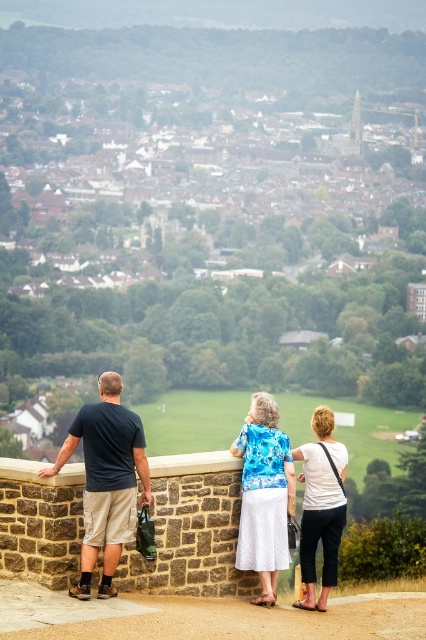
Based on the scene description, where is the blue floral blouse at center located in terms of coordinates?

The blue floral blouse at center is located at coordinates point (264, 493).

You are a photographer positioned behind the blue floral blouse at center and the white cotton shirt at center. Which of the two subjects is blocking your view of the other?

The blue floral blouse at center is blocking the view of the white cotton shirt at center because it is positioned in front of it.

You are standing at the overlook and want to take a photo of the two points marked in the scene. Which point, point 1 at coordinates [89,589] or point 2 at coordinates [305,531], will appear larger in your photo?

Point 1 at coordinates [89,589] will appear larger in the photo because it is closer to the viewer than point 2 at coordinates [305,531].